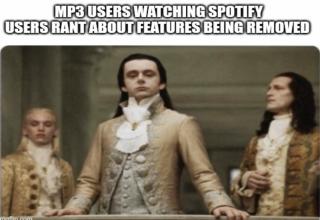
This screenshot has width=320, height=220. What are the coordinates of `wall` in the screenshot? It's located at (219, 97).